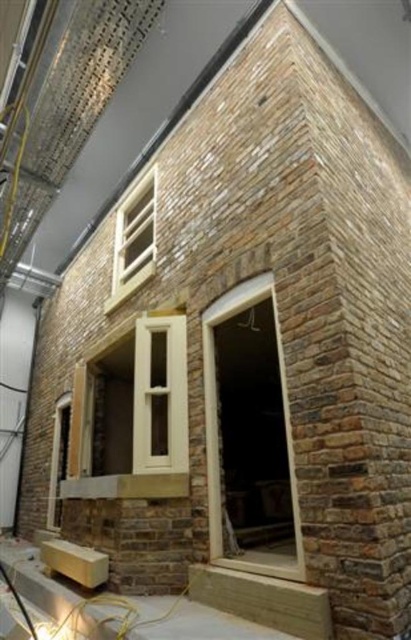
Question: Which of the following is the closest to the observer?

Choices:
 (A) white plastic window at center
 (B) white wood window at upper center

Answer: (A)

Question: Is white plastic window at center above smooth cream window at center?

Choices:
 (A) no
 (B) yes

Answer: (A)

Question: Which of the following is the closest to the observer?

Choices:
 (A) (134, 323)
 (B) (154, 236)
 (C) (265, 573)

Answer: (C)

Question: Which of these objects is positioned farthest from the white wood window at upper center?

Choices:
 (A) smooth cream window at center
 (B) white plastic window at center

Answer: (A)

Question: Does white plastic window at center appear under smooth cream window at center?

Choices:
 (A) yes
 (B) no

Answer: (A)

Question: Is smooth cream window at center to the left of white wood window at upper center from the viewer's perspective?

Choices:
 (A) yes
 (B) no

Answer: (B)